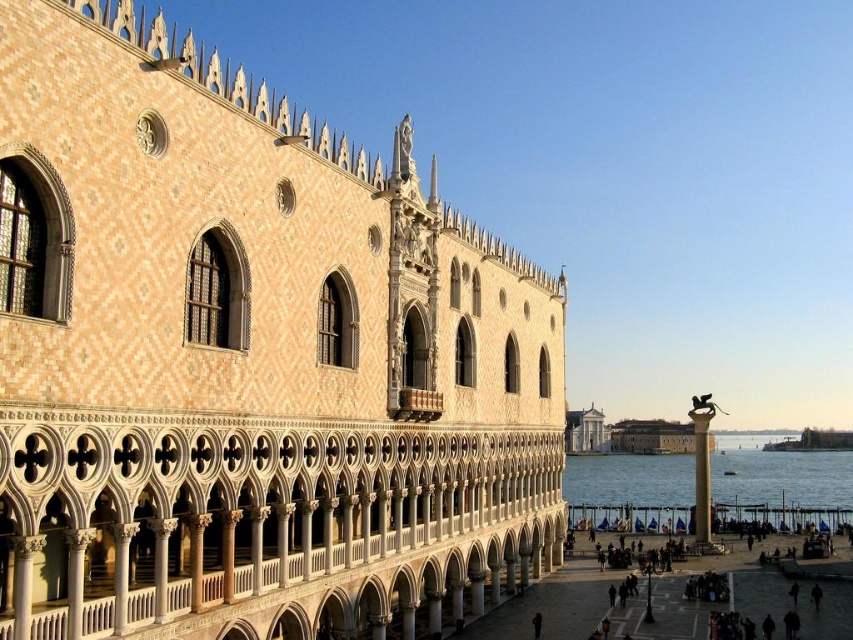
Can you confirm if clear blue water at lower right is positioned to the left of bronze statue at center?

In fact, clear blue water at lower right is to the right of bronze statue at center.

The image size is (853, 640). I want to click on clear blue water at lower right, so click(x=782, y=484).

This screenshot has height=640, width=853. Find the location of `clear blue water at lower right`. clear blue water at lower right is located at coordinates (782, 484).

Which is in front, point (337, 612) or point (672, 480)?

Point (337, 612) is in front.

Looking at this image, can you confirm if beige mosaic palace at left is shorter than clear blue water at lower right?

No.

Who is more distant from viewer, (393, 269) or (759, 493)?

Point (759, 493)

Locate an element on the screen. beige mosaic palace at left is located at coordinates (248, 358).

Does beige mosaic palace at left appear over bronze statue at center?

Yes, beige mosaic palace at left is above bronze statue at center.

Can you confirm if beige mosaic palace at left is wider than bronze statue at center?

No.

This screenshot has width=853, height=640. What do you see at coordinates (248, 358) in the screenshot?
I see `beige mosaic palace at left` at bounding box center [248, 358].

Find the location of a particular element. The image size is (853, 640). beige mosaic palace at left is located at coordinates (248, 358).